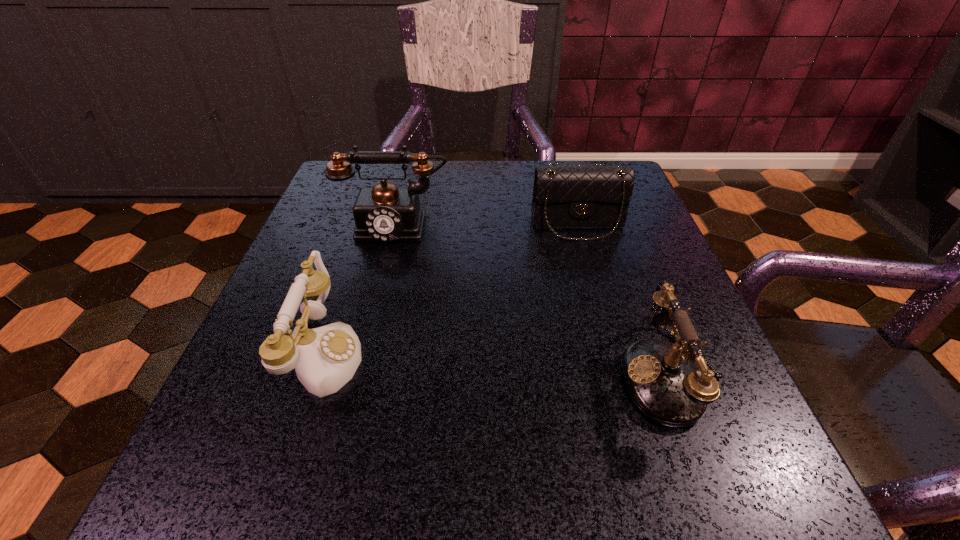
Where is `clutch bag located at the far edge`? clutch bag located at the far edge is located at coordinates (569, 195).

Where is `object that is at the near edge`? object that is at the near edge is located at coordinates (664, 383).

Image resolution: width=960 pixels, height=540 pixels. Identify the location of telephone positioned at the right edge. (664, 383).

Where is `clutch bag at the right edge`? The image size is (960, 540). clutch bag at the right edge is located at coordinates (569, 195).

This screenshot has height=540, width=960. I want to click on object that is at the far left corner, so click(384, 213).

Where is `object located in the far right corner section of the desktop`? The image size is (960, 540). object located in the far right corner section of the desktop is located at coordinates (569, 195).

Find the location of a particular element. This screenshot has height=540, width=960. object positioned at the near right corner is located at coordinates (664, 383).

In the image, there is a desktop. Where is `free space at the far edge`? This screenshot has height=540, width=960. free space at the far edge is located at coordinates (492, 209).

What are the coordinates of `vacant position at the near edge of the desktop` in the screenshot? It's located at (528, 447).

In the image, there is a desktop. Where is `free space at the left edge`? This screenshot has width=960, height=540. free space at the left edge is located at coordinates (300, 421).